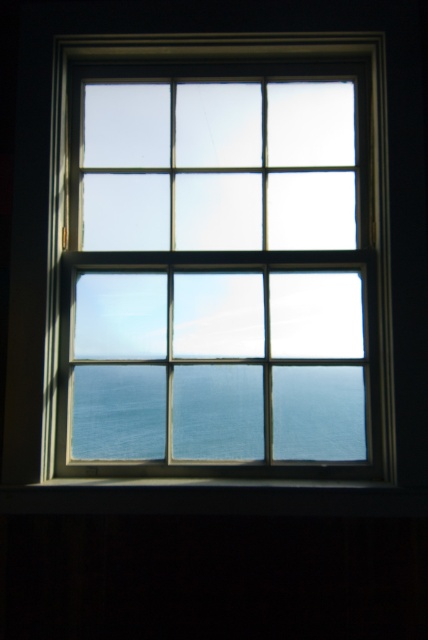
Is clear glass window at center positioned before blue glassy water at center?

Yes, clear glass window at center is closer to the viewer.

Which is above, clear glass window at center or blue glassy water at center?

Positioned higher is clear glass window at center.

Does point (368, 440) come closer to viewer compared to point (335, 448)?

That is True.

This screenshot has width=428, height=640. What are the coordinates of `clear glass window at center` in the screenshot? It's located at (219, 260).

What do you see at coordinates (219, 260) in the screenshot?
I see `clear glass window at center` at bounding box center [219, 260].

Can you confirm if clear glass window at center is taller than dark wood paneling at bottom?

Yes.

The image size is (428, 640). What are the coordinates of `clear glass window at center` in the screenshot? It's located at (219, 260).

Where is `clear glass window at center`? clear glass window at center is located at coordinates (219, 260).

Who is lower down, dark wood paneling at bottom or blue glassy water at center?

dark wood paneling at bottom is below.

Which is in front, point (380, 593) or point (184, 429)?

Positioned in front is point (380, 593).

The width and height of the screenshot is (428, 640). Identify the location of dark wood paneling at bottom. (213, 577).